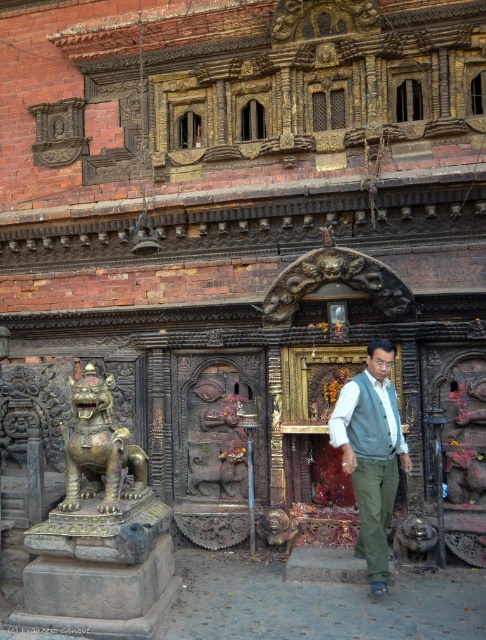
Does gold polished lion at left lie behind white matte shirt at center?

No.

In the scene shown: Who is more forward, (108, 387) or (370, 444)?

Point (108, 387)

Find the location of `gold polished lion at left`. gold polished lion at left is located at coordinates (99, 448).

Is point (364, 522) less distant than point (104, 467)?

That is False.

Which is above, light blue fabric vest at center or gold polished lion at left?

gold polished lion at left is above.

Locate an element on the screen. This screenshot has width=486, height=640. light blue fabric vest at center is located at coordinates (371, 452).

Image resolution: width=486 pixels, height=640 pixels. What do you see at coordinates (371, 452) in the screenshot?
I see `light blue fabric vest at center` at bounding box center [371, 452].

Is point (395, 452) farther from viewer compared to point (396, 449)?

Yes, point (395, 452) is farther from viewer.

Locate an element on the screen. Image resolution: width=486 pixels, height=640 pixels. light blue fabric vest at center is located at coordinates tap(371, 452).